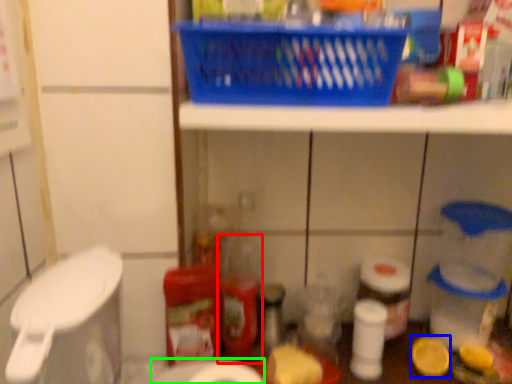
Question: Which object is positioned closest to bottle (highlighted by a red box)? Select from lemon (highlighted by a blue box) and toilet paper (highlighted by a green box).

Choices:
 (A) lemon
 (B) toilet paper

Answer: (B)